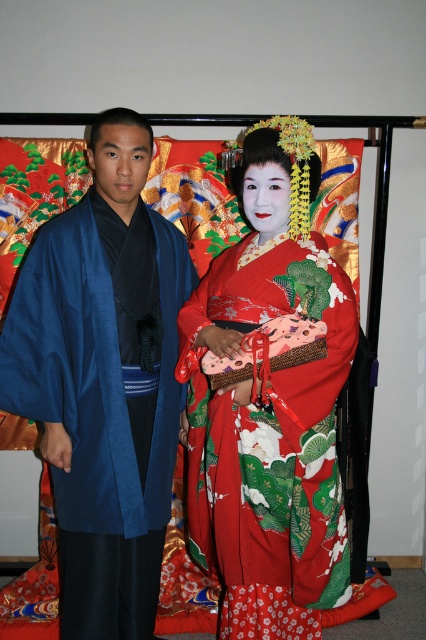
Question: Which object appears farthest from the camera in this image?

Choices:
 (A) blue silk kimono at left
 (B) silky red kimono at center

Answer: (A)

Question: Which object is farther from the camera taking this photo?

Choices:
 (A) silky red kimono at center
 (B) blue silk kimono at left

Answer: (B)

Question: Can you confirm if blue silk kimono at left is wider than silky red kimono at center?

Choices:
 (A) yes
 (B) no

Answer: (A)

Question: Can you confirm if blue silk kimono at left is positioned above silky red kimono at center?

Choices:
 (A) no
 (B) yes

Answer: (B)

Question: Is blue silk kimono at left below silky red kimono at center?

Choices:
 (A) yes
 (B) no

Answer: (B)